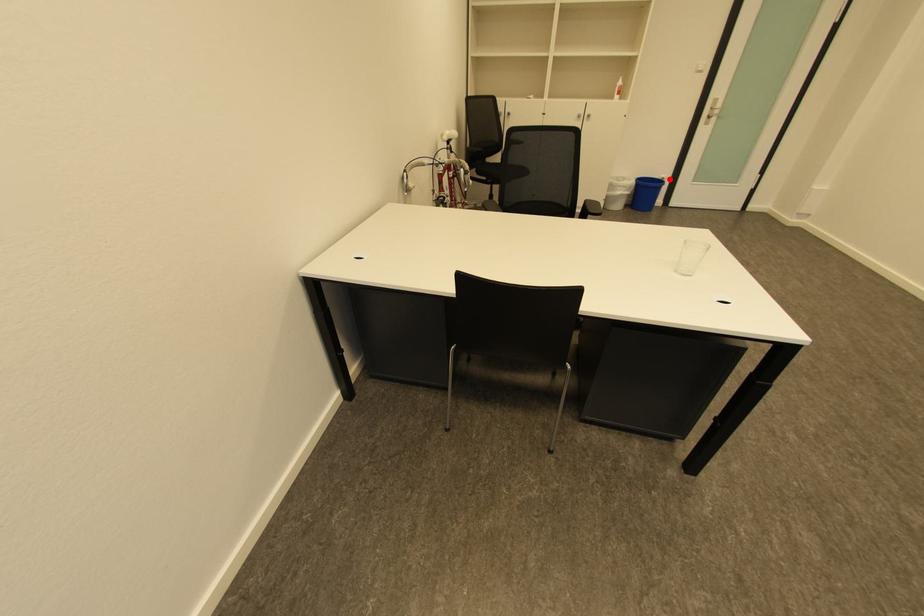
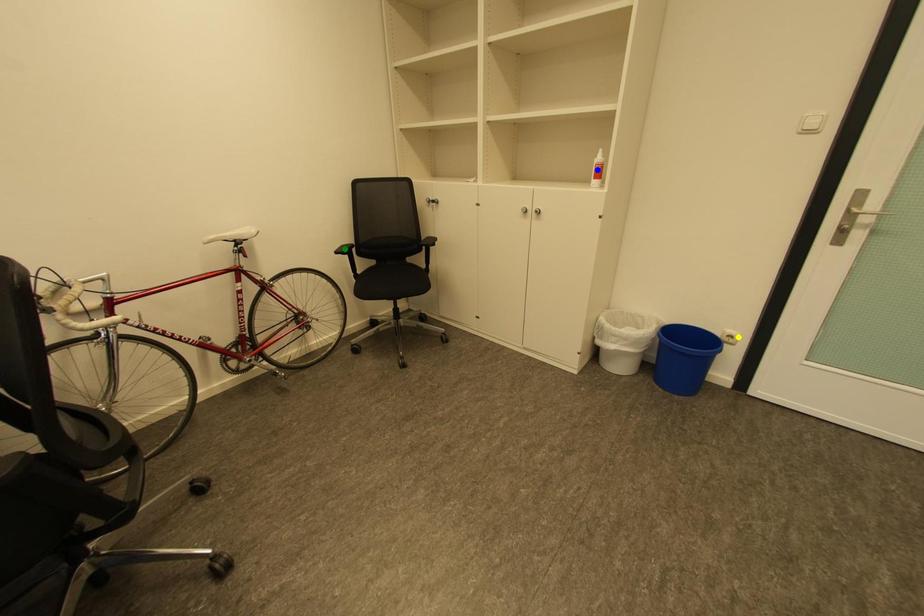
Question: I am providing you with two images of the same scene from different viewpoints. A red point is marked on the first image. You are given multiple points on the second image. Which spot in image 2 lines up with the point in image 1?

Choices:
 (A) blue point
 (B) green point
 (C) yellow point

Answer: (C)